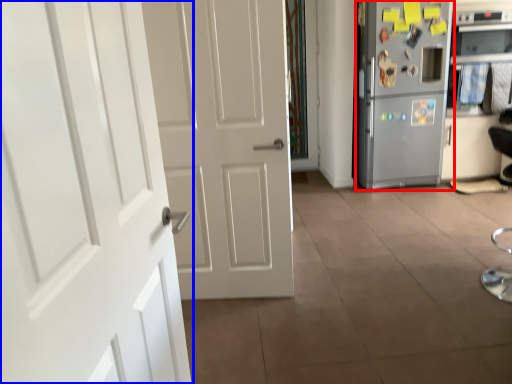
Question: Which of the following is the farthest to the observer, refrigerator (highlighted by a red box) or door (highlighted by a blue box)?

Choices:
 (A) refrigerator
 (B) door

Answer: (A)